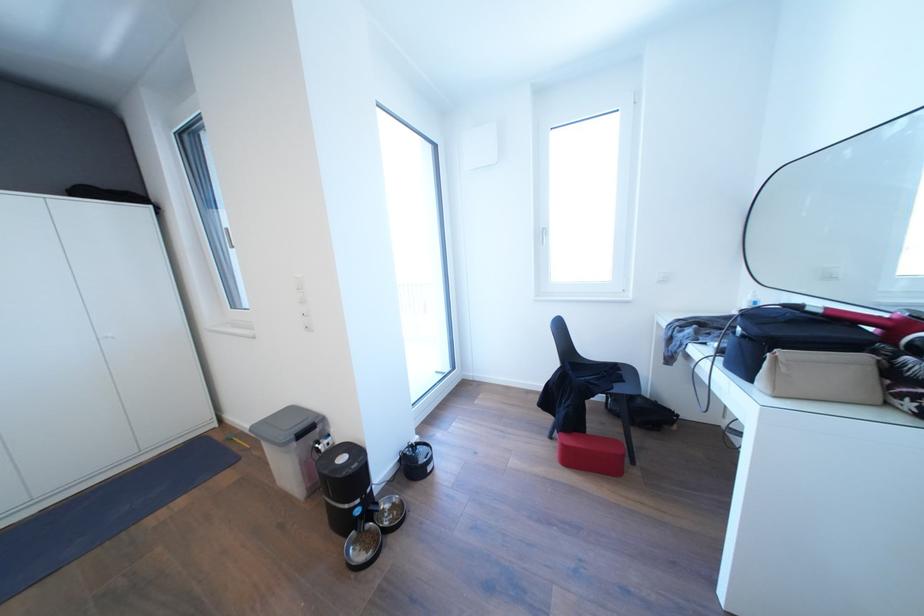
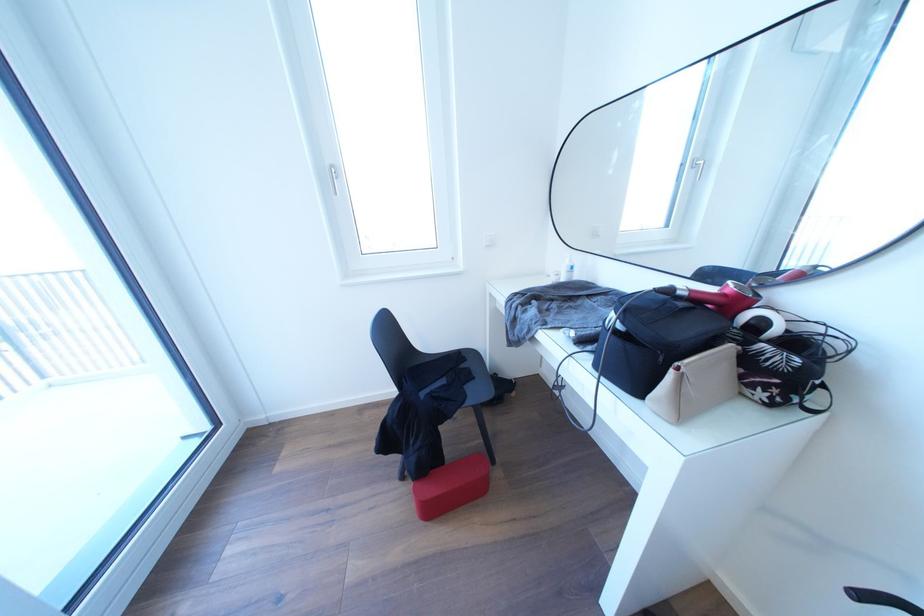
Where in the second image is the point corresponding to [805,312] from the first image?

(675, 296)